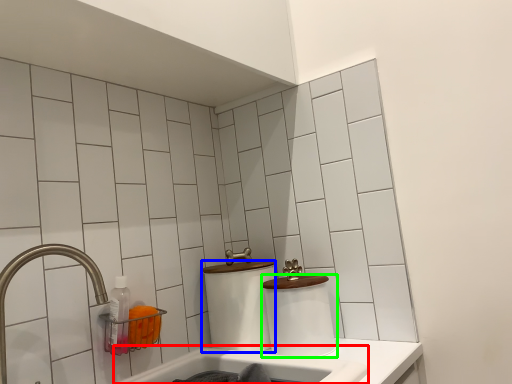
Question: Which object is positioned closest to bath (highlighted by a red box)? Select from toilet paper (highlighted by a blue box) and toilet paper (highlighted by a green box).

Choices:
 (A) toilet paper
 (B) toilet paper

Answer: (B)